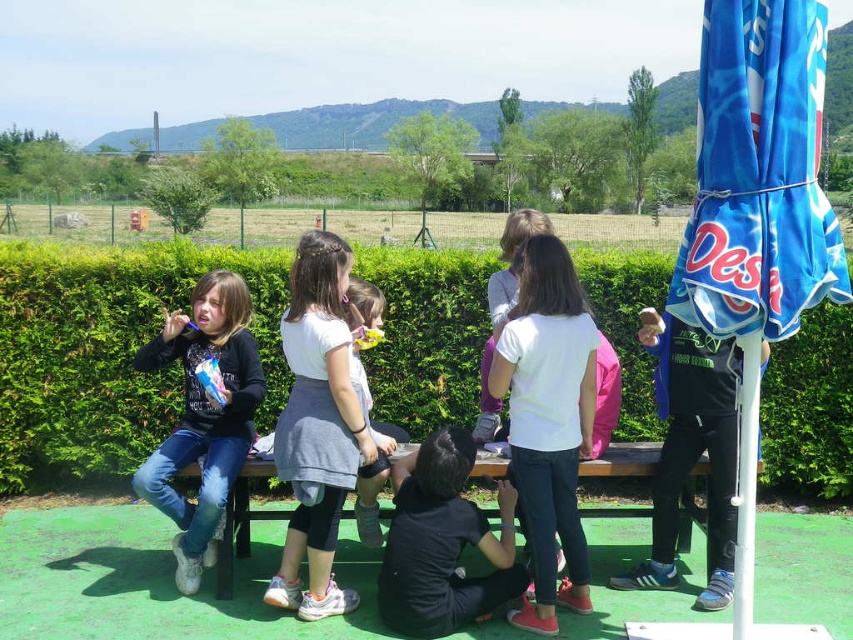
Does point (567, 376) come farther from viewer compared to point (227, 595)?

No, (567, 376) is closer to viewer.

From the picture: Who is lower down, white matte shirt at center or green painted wood bench at center?

green painted wood bench at center is below.

Describe the element at coordinates (548, 420) in the screenshot. This screenshot has width=853, height=640. I see `white matte shirt at center` at that location.

You are a GUI agent. You are given a task and a screenshot of the screen. Output one action in this format:
    pyautogui.click(x=<x>, y=<y>)
    Task: Click on the white matte shirt at center
    This screenshot has width=853, height=640.
    Given the screenshot: What is the action you would take?
    pyautogui.click(x=548, y=420)

Is green leafy hedge at center thinner than green painted wood bench at center?

No.

Is green leafy hedge at center wider than green painted wood bench at center?

Yes, green leafy hedge at center is wider than green painted wood bench at center.

Is point (653, 272) positioned in front of point (643, 445)?

No, (653, 272) is further to viewer.

At what (x,y) coordinates should I click in order to perform the action: click on green leafy hedge at center. Please return your answer as a coordinate pair (x, y). Looking at the image, I should click on (107, 349).

Looking at this image, who is lower down, matte black shirt at left or green painted wood bench at center?

green painted wood bench at center is lower down.

The height and width of the screenshot is (640, 853). Describe the element at coordinates (202, 416) in the screenshot. I see `matte black shirt at left` at that location.

At what (x,y) coordinates should I click in order to perform the action: click on matte black shirt at left. Please return your answer as a coordinate pair (x, y). Image resolution: width=853 pixels, height=640 pixels. Looking at the image, I should click on (202, 416).